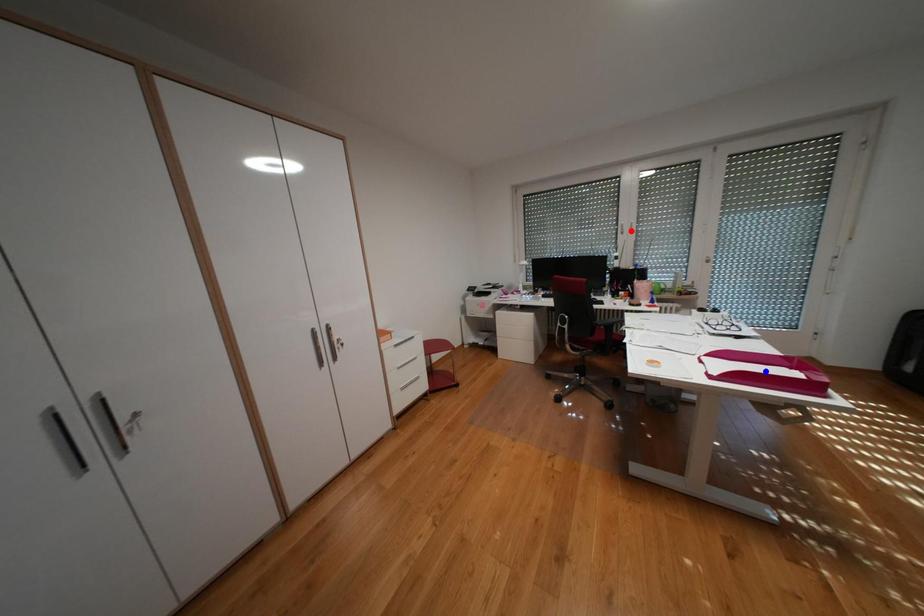
Question: Which of the two points in the image is closer to the camera?

Choices:
 (A) Blue point is closer.
 (B) Red point is closer.

Answer: (A)